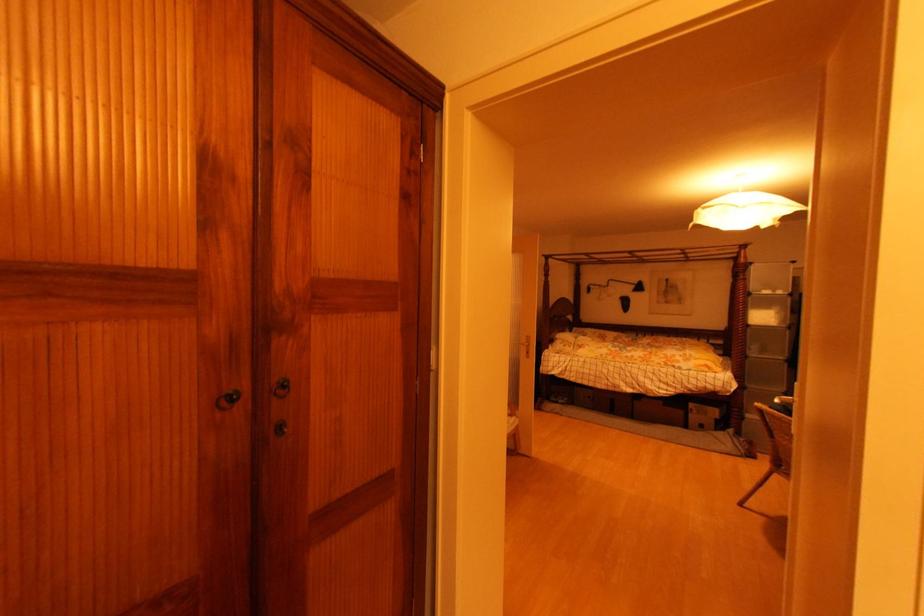
You are a GUI agent. You are given a task and a screenshot of the screen. Output one action in this format:
    pyautogui.click(x=<x>, y=<y>)
    Task: Click on the black reading lamp
    The width and height of the screenshot is (924, 616).
    Given the screenshot: What is the action you would take?
    pyautogui.click(x=641, y=286)